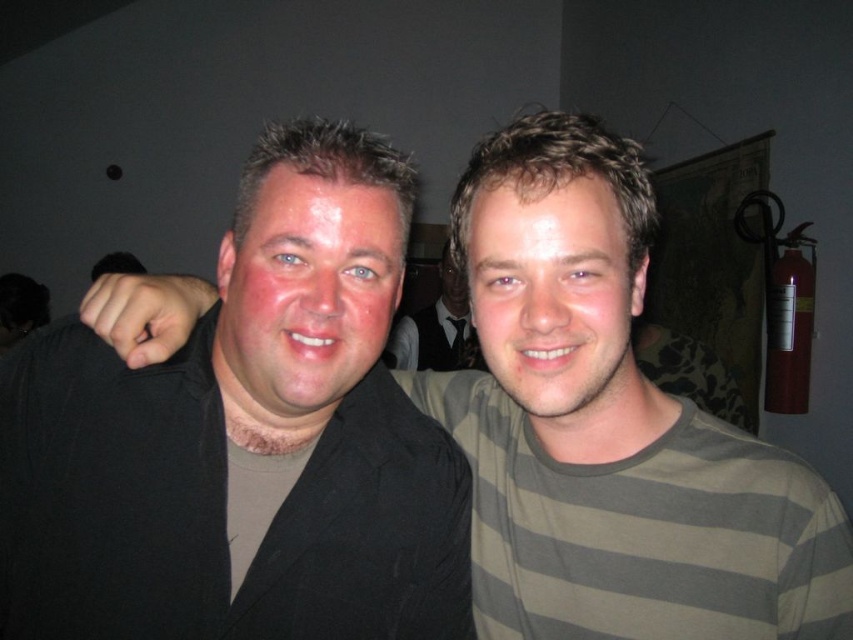
You are a photographer trying to capture a candid shot of the matte black face at center and the brown striped shirt at center. Since you want to ensure both subjects are in focus, you need to know their relative heights. Which one is taller?

The matte black face at center is much taller as brown striped shirt at center, so the matte black face at center is taller.

You are a photographer trying to capture a candid shot of the matte black face at center and the brown striped shirt at center. Your camera has a minimum focus distance of 5 inches. Can you take a photo of both subjects without moving them?

The distance between the matte black face at center and brown striped shirt at center is 5.35 inches, which is greater than the camera minimum focus distance of 5 inches. Yes, you can take a photo of both subjects without moving them.

You are a photographer standing at the point marked by the coordinates point (300,243). You want to take a photo of the two people in the scene. Considering your position, will you be able to capture both individuals in a single frame without moving? Explain your reasoning.

The two people are 23.87 inches apart. Since you are positioned at point (300,243), which is between them, you can capture both individuals in a single frame as they are relatively close to each other and within a reasonable distance from your position.